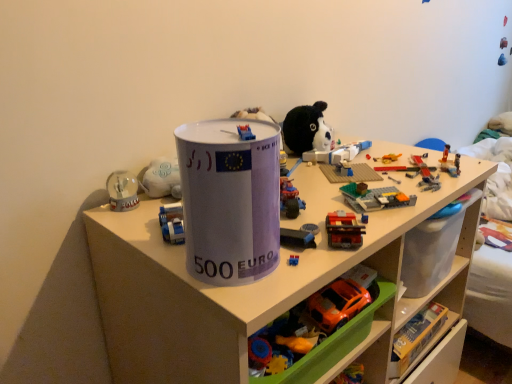
Image resolution: width=512 pixels, height=384 pixels. I want to click on free space between rubberized plastic toy car at center, which appears as the 4th toy when ordered from the bottom, and brick-like plastic train at center-right, the third toy when ordered from bottom to top, so click(x=315, y=215).